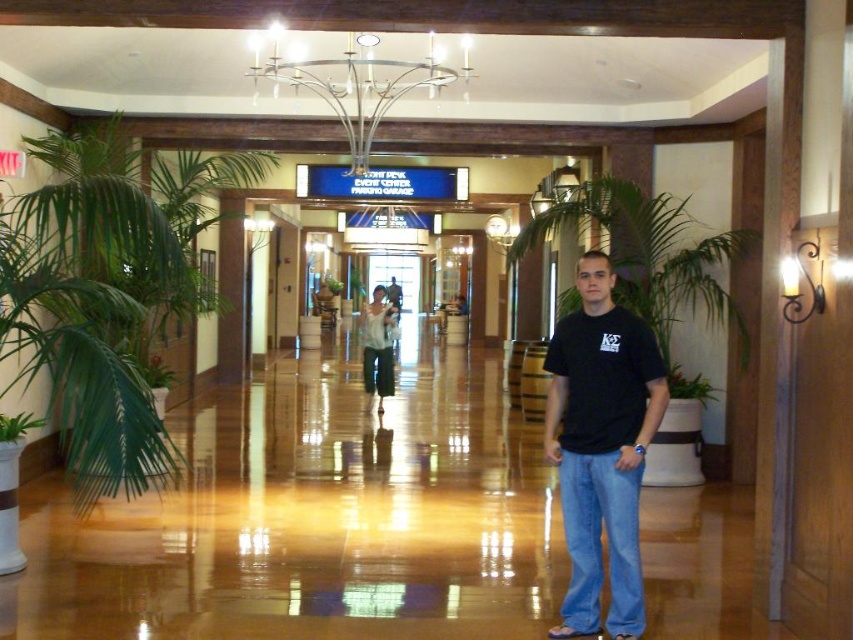
Is green leafy plant at center thinner than silver metallic chandelier at upper center?

No, green leafy plant at center is not thinner than silver metallic chandelier at upper center.

Does green leafy plant at center lie behind silver metallic chandelier at upper center?

Yes, green leafy plant at center is behind silver metallic chandelier at upper center.

Where is `green leafy plant at center`? This screenshot has height=640, width=853. green leafy plant at center is located at coordinates (651, 260).

At what (x,y) coordinates should I click in order to perform the action: click on green leafy plant at center. Please return your answer as a coordinate pair (x, y). This screenshot has height=640, width=853. Looking at the image, I should click on (651, 260).

Is the position of silver metallic chandelier at upper center more distant than that of matte black shirt at center?

No.

Who is lower down, silver metallic chandelier at upper center or matte black shirt at center?

matte black shirt at center is below.

At what (x,y) coordinates should I click in order to perform the action: click on silver metallic chandelier at upper center. Please return your answer as a coordinate pair (x, y). Looking at the image, I should click on (357, 81).

Between white cotton shirt at center and matte black shirt at center, which one has more height?

With more height is white cotton shirt at center.

Is point (379, 339) positioned before point (389, 292)?

Yes.

Does point (364, 346) come farther from viewer compared to point (392, 292)?

No, it is not.

At what (x,y) coordinates should I click in order to perform the action: click on white cotton shirt at center. Please return your answer as a coordinate pair (x, y). This screenshot has height=640, width=853. Looking at the image, I should click on (378, 346).